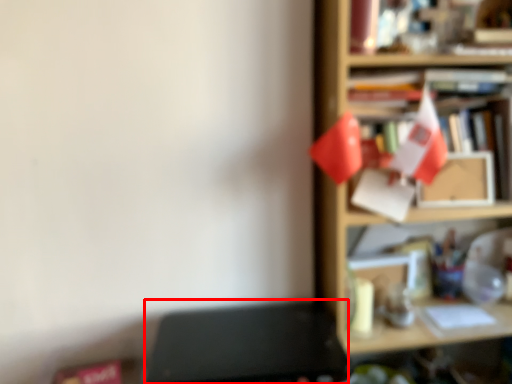
Question: From the image's perspective, what is the correct spatial relationship of writing desk (annotated by the red box) in relation to shelf?

Choices:
 (A) above
 (B) below

Answer: (B)